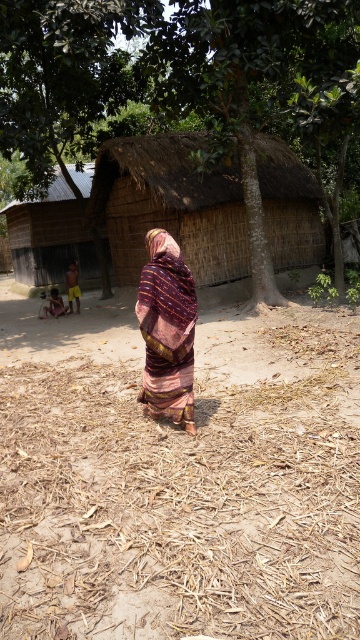
Question: Which object is the farthest from the thatched straw hut at center?

Choices:
 (A) dark brown wooden hut at left
 (B) brown dry grass at center

Answer: (B)

Question: Is brown dry grass at center smaller than thatched straw hut at center?

Choices:
 (A) yes
 (B) no

Answer: (B)

Question: Which of the following is the farthest from the observer?

Choices:
 (A) brown dry grass at center
 (B) multicolored woven cloth at center
 (C) thatched straw hut at center

Answer: (C)

Question: Does brown dry grass at center appear on the left side of dark brown wooden hut at left?

Choices:
 (A) no
 (B) yes

Answer: (A)

Question: Is green leafy tree at center positioned at the back of dark brown wooden hut at left?

Choices:
 (A) no
 (B) yes

Answer: (A)

Question: Which of the following is the closest to the observer?

Choices:
 (A) dark brown wooden hut at left
 (B) multicolored woven cloth at center

Answer: (B)